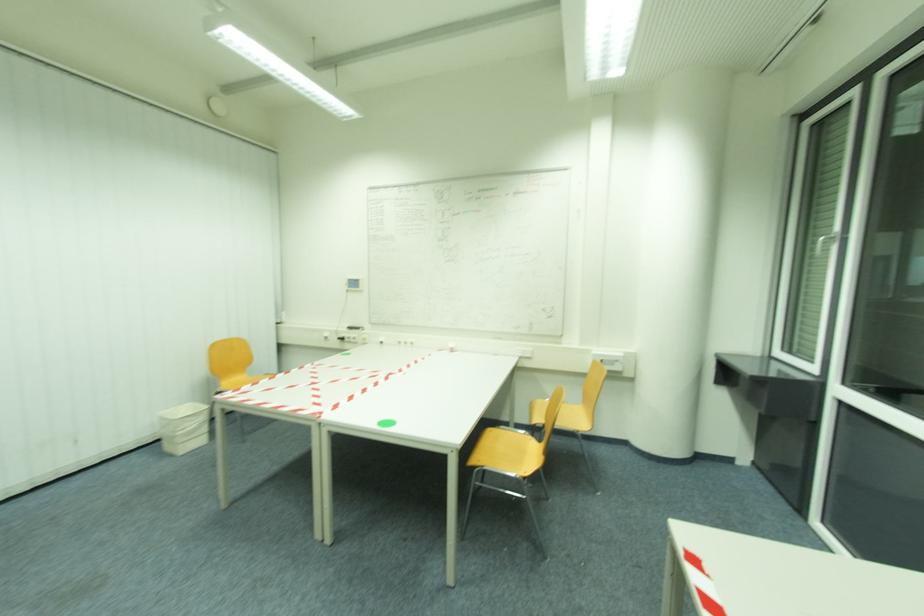
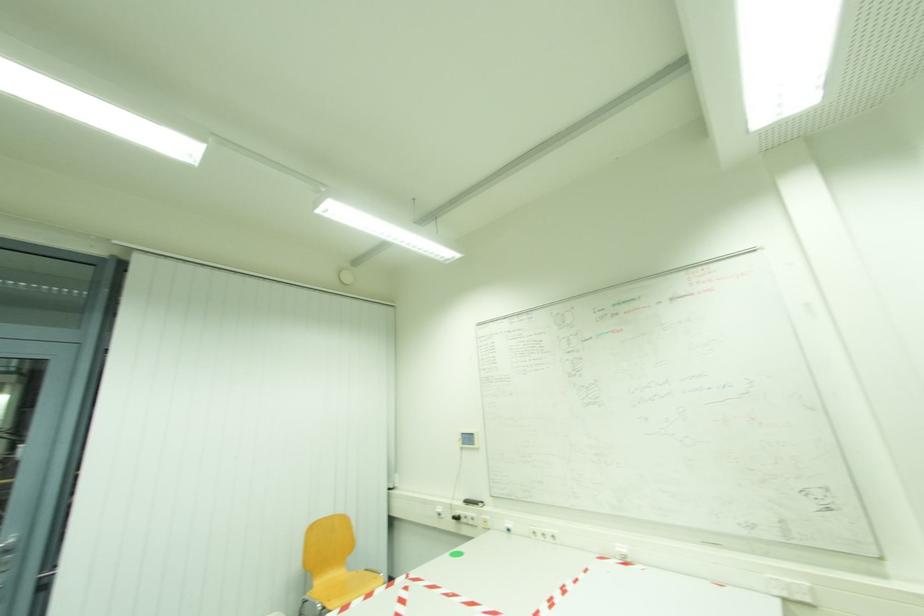
The first image is from the beginning of the video and the second image is from the end. How did the camera likely rotate when shooting the video?

The camera's rotation is toward left-up.